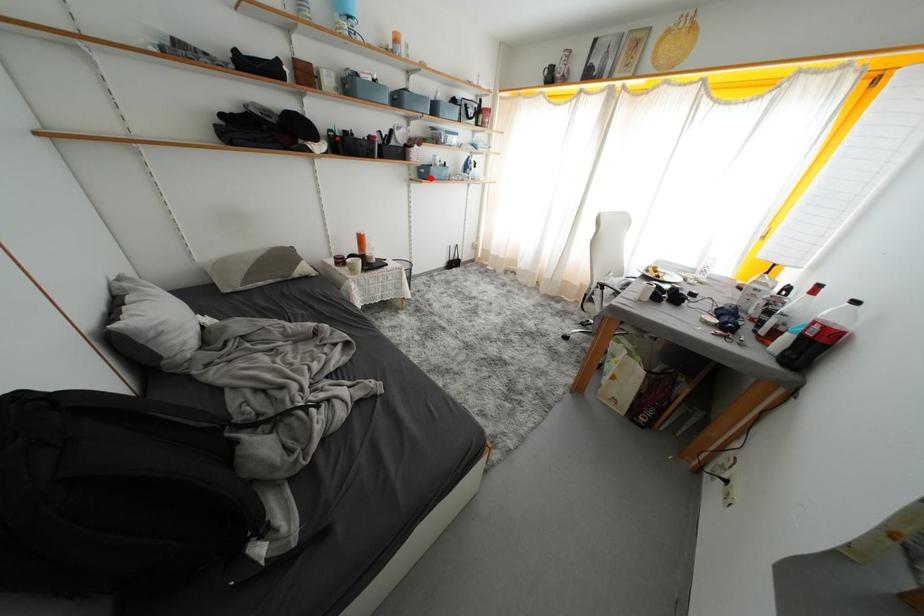
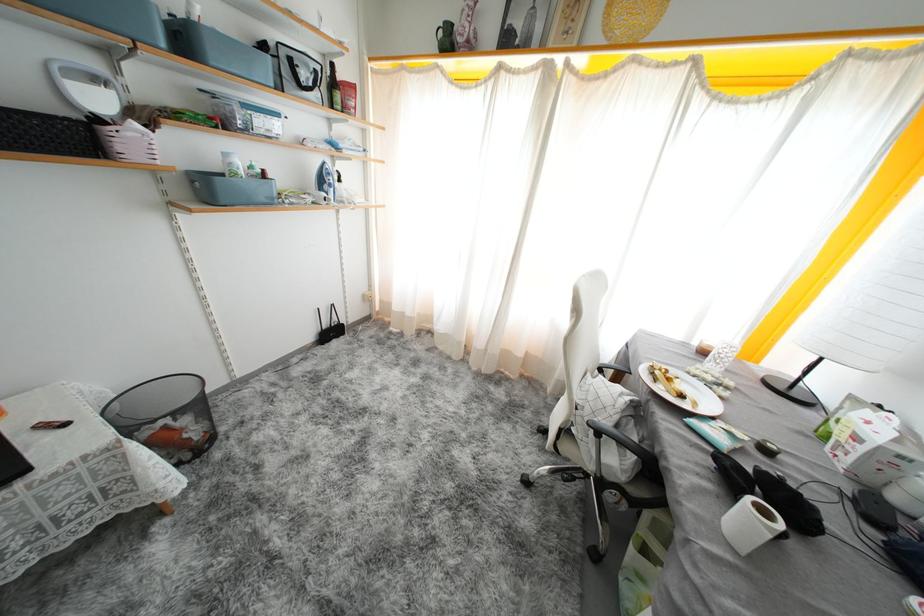
Find the pixel in the second image that matches the highlighted location in the first image.

(215, 196)